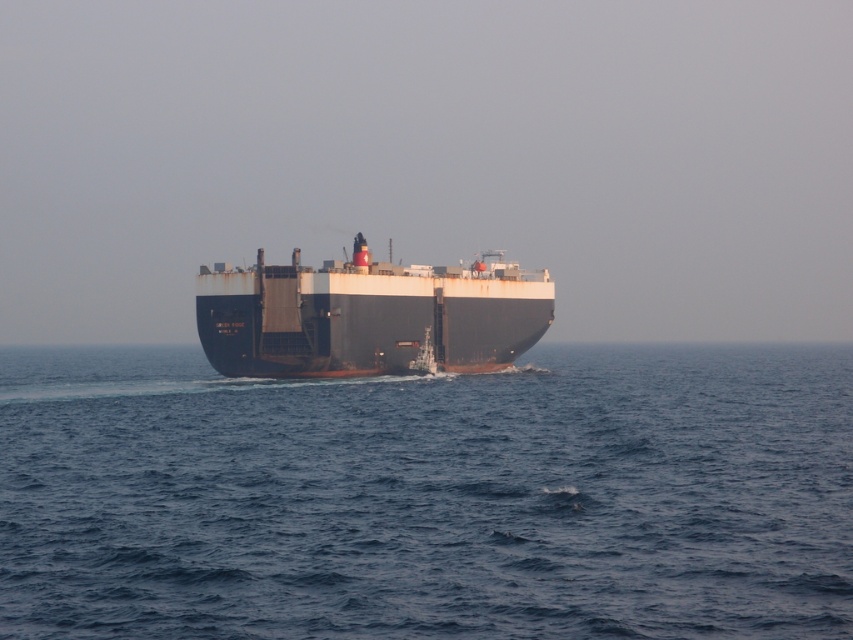
Is blue water at center in front of rustic metal ship at center?

Yes, it is in front of rustic metal ship at center.

Measure the distance from blue water at center to rustic metal ship at center.

The distance of blue water at center from rustic metal ship at center is 17.88 meters.

At what (x,y) coordinates should I click in order to perform the action: click on blue water at center. Please return your answer as a coordinate pair (x, y). Image resolution: width=853 pixels, height=640 pixels. Looking at the image, I should click on (428, 497).